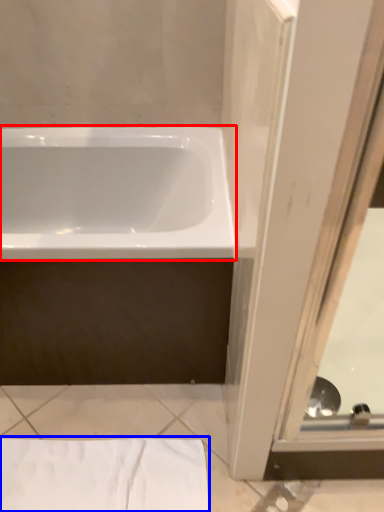
Question: Which point is further to the camera, bathtub (highlighted by a red box) or sheet (highlighted by a blue box)?

Choices:
 (A) bathtub
 (B) sheet

Answer: (B)